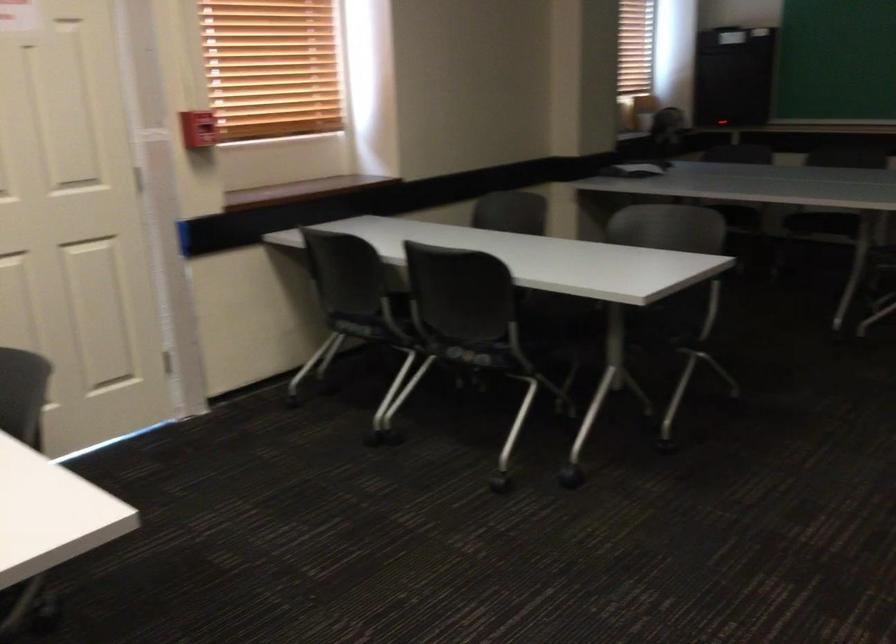
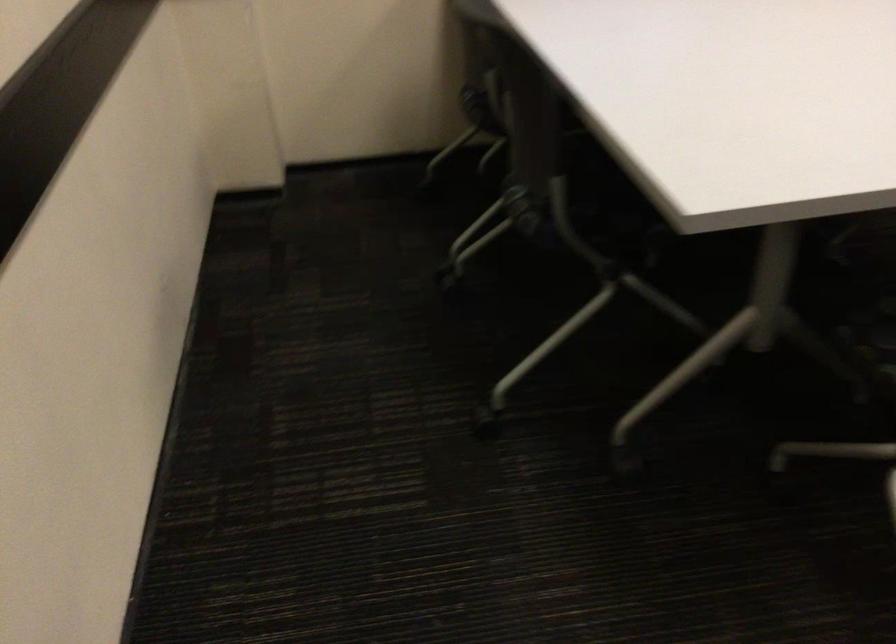
Consider the image. First-person continuous shooting, in which direction is the camera rotating?

The rotation direction of the camera is left-down.